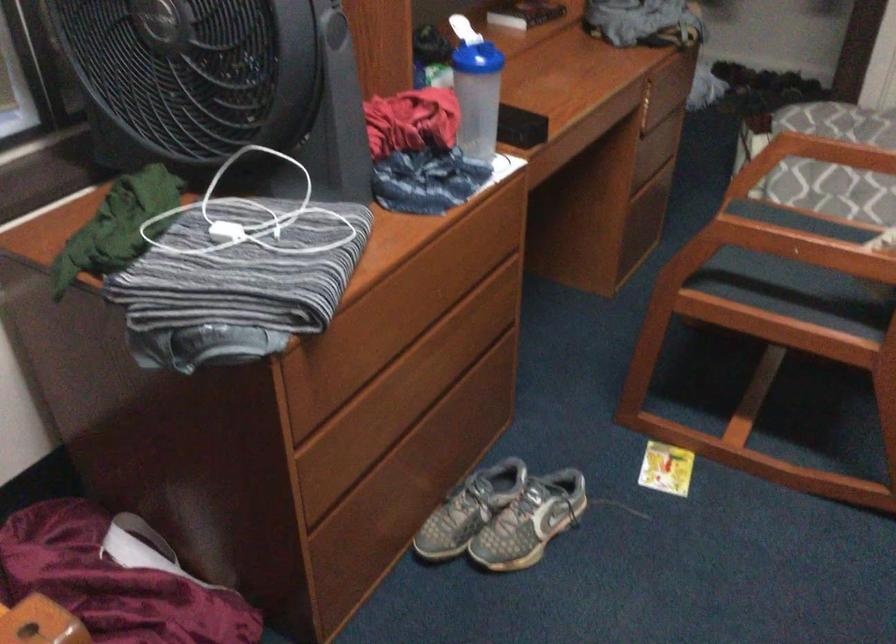
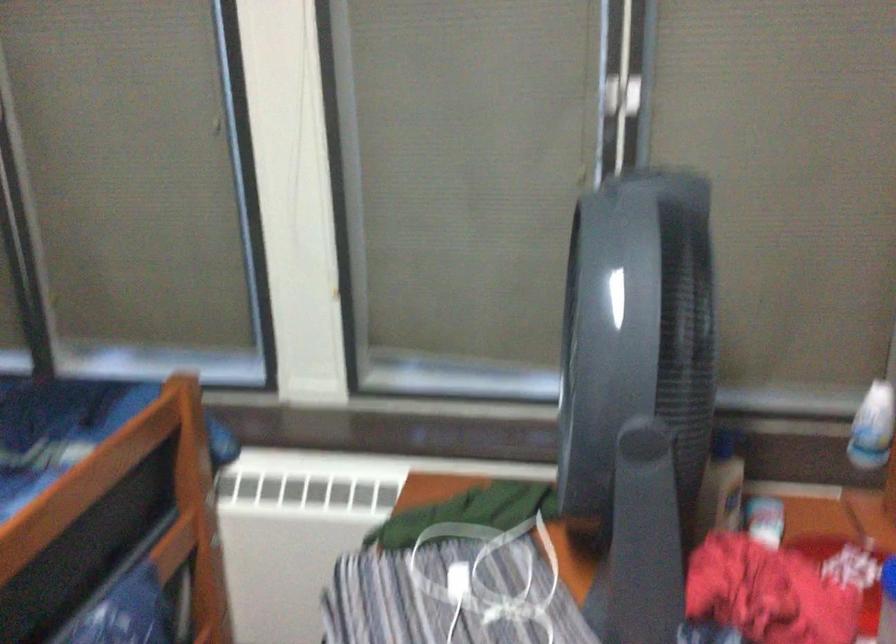
Question: The images are taken continuously from a first-person perspective. In which direction is your viewpoint rotating?

Choices:
 (A) Left
 (B) Right
 (C) Up
 (D) Down

Answer: (A)